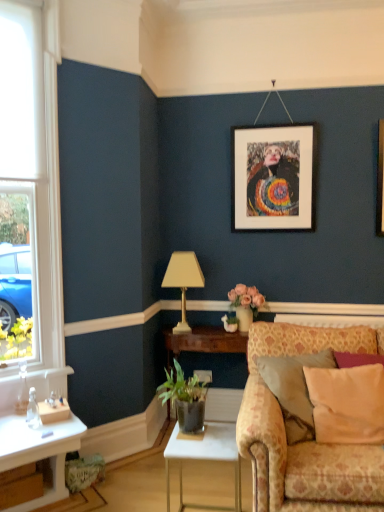
Question: Can you see floral-patterned fabric couch at lower right touching beige fabric pillow at right?

Choices:
 (A) yes
 (B) no

Answer: (B)

Question: Is beige fabric pillow at right inside floral-patterned fabric couch at lower right?

Choices:
 (A) no
 (B) yes

Answer: (B)

Question: Is there a large distance between floral-patterned fabric couch at lower right and beige fabric pillow at right?

Choices:
 (A) no
 (B) yes

Answer: (A)

Question: Is floral-patterned fabric couch at lower right wider than beige fabric pillow at right?

Choices:
 (A) no
 (B) yes

Answer: (B)

Question: From a real-world perspective, is floral-patterned fabric couch at lower right under beige fabric pillow at right?

Choices:
 (A) no
 (B) yes

Answer: (B)

Question: Considering the relative positions of floral-patterned fabric couch at lower right and beige fabric pillow at right in the image provided, is floral-patterned fabric couch at lower right to the left of beige fabric pillow at right from the viewer's perspective?

Choices:
 (A) no
 (B) yes

Answer: (B)

Question: Is green leafy plant in terracotta pot at lower center surrounding white wood window at left?

Choices:
 (A) yes
 (B) no

Answer: (B)

Question: Is white wood window at left at the back of green leafy plant in terracotta pot at lower center?

Choices:
 (A) yes
 (B) no

Answer: (B)

Question: From a real-world perspective, is green leafy plant in terracotta pot at lower center below white wood window at left?

Choices:
 (A) yes
 (B) no

Answer: (A)

Question: From a real-world perspective, is green leafy plant in terracotta pot at lower center physically above white wood window at left?

Choices:
 (A) no
 (B) yes

Answer: (A)

Question: Could you tell me if green leafy plant in terracotta pot at lower center is facing white wood window at left?

Choices:
 (A) no
 (B) yes

Answer: (A)

Question: Does green leafy plant in terracotta pot at lower center have a greater width compared to white wood window at left?

Choices:
 (A) no
 (B) yes

Answer: (B)

Question: Can you confirm if beige fabric pillow at right is positioned to the left of gold metallic table lamp at center?

Choices:
 (A) no
 (B) yes

Answer: (A)